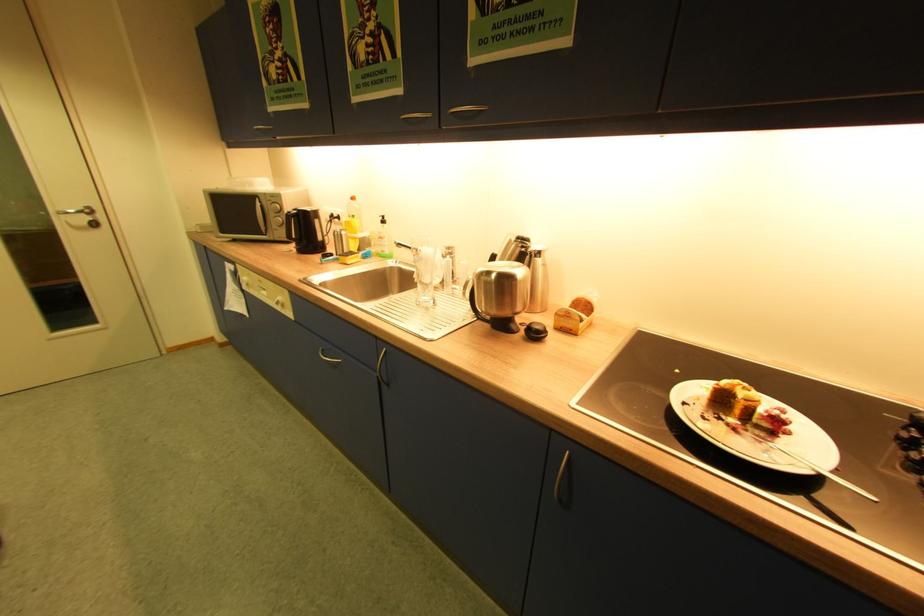
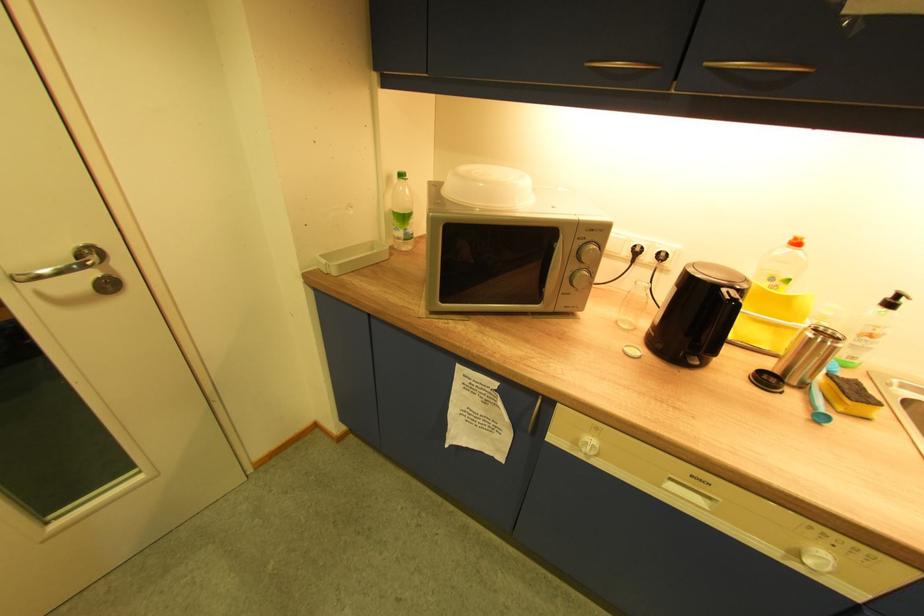
Locate, in the second image, the point that corresponds to pixel 343 235 in the first image.

(830, 342)